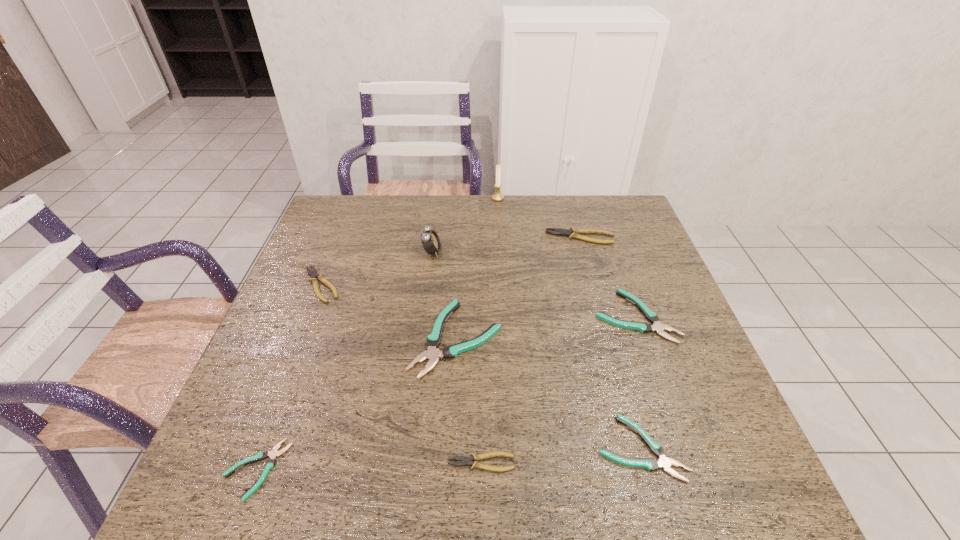
You are a GUI agent. You are given a task and a screenshot of the screen. Output one action in this format:
    pyautogui.click(x=<x>, y=<y>)
    Task: Click on the second smallest teal pliers
    
    Given the screenshot: What is the action you would take?
    pyautogui.click(x=650, y=464)

At what (x,y) coordinates should I click in order to perform the action: click on the second yellow pliers from right to left. Please return your answer as a coordinate pair (x, y). The width and height of the screenshot is (960, 540). Looking at the image, I should click on (465, 461).

This screenshot has width=960, height=540. Find the location of `the smallest yellow pliers`. the smallest yellow pliers is located at coordinates (465, 461).

Find the location of a particular element. This screenshot has width=960, height=540. the shortest object is located at coordinates (274, 452).

The height and width of the screenshot is (540, 960). In order to click on the leftmost teal pliers in this screenshot , I will do `click(274, 452)`.

I want to click on vacant area situated on the left of the farthest object, so click(460, 198).

You are a GUI agent. You are given a task and a screenshot of the screen. Output one action in this format:
    pyautogui.click(x=<x>, y=<y>)
    Task: Click on the free space located 0.100m on the face of the white alarm clock
    This screenshot has height=540, width=960.
    Given the screenshot: What is the action you would take?
    pyautogui.click(x=475, y=252)

Where is `blank space located on the left of the biggest yellow pliers`? The height and width of the screenshot is (540, 960). blank space located on the left of the biggest yellow pliers is located at coordinates click(x=494, y=238).

Image resolution: width=960 pixels, height=540 pixels. Find the location of `free location located on the front of the biggest teal pliers`. free location located on the front of the biggest teal pliers is located at coordinates (452, 422).

You are a GUI agent. You are given a task and a screenshot of the screen. Output one action in this format:
    pyautogui.click(x=<x>, y=<y>)
    Task: Click on the vacant space located on the back of the second biggest teal pliers
    The height and width of the screenshot is (540, 960).
    Given the screenshot: What is the action you would take?
    pyautogui.click(x=607, y=236)